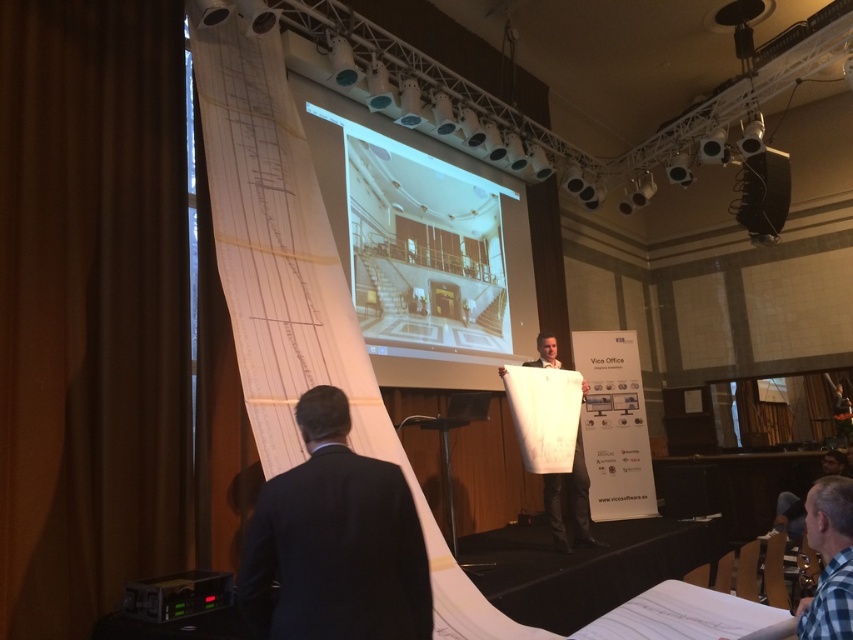
Between white matte projection screen at center and dark suit at lower left, which one appears on the left side from the viewer's perspective?

dark suit at lower left is more to the left.

Measure the distance between white matte projection screen at center and dark suit at lower left.

A distance of 3.50 meters exists between white matte projection screen at center and dark suit at lower left.

Find the location of a particular element. white matte projection screen at center is located at coordinates (424, 246).

Between brown fabric curtain at left and dark suit at lower left, which one appears on the right side from the viewer's perspective?

Positioned to the right is dark suit at lower left.

Between brown fabric curtain at left and dark suit at lower left, which one is positioned higher?

brown fabric curtain at left

Is point (54, 323) farther from camera compared to point (381, 554)?

Yes, it is behind point (381, 554).

Image resolution: width=853 pixels, height=640 pixels. In order to click on brown fabric curtain at left in this screenshot , I will do `click(90, 307)`.

Who is lower down, brown fabric curtain at left or white matte projection screen at center?

Positioned lower is brown fabric curtain at left.

Is point (48, 225) positioned before point (520, 292)?

Yes, point (48, 225) is closer to viewer.

The image size is (853, 640). Describe the element at coordinates (90, 307) in the screenshot. I see `brown fabric curtain at left` at that location.

At what (x,y) coordinates should I click in order to perform the action: click on brown fabric curtain at left. Please return your answer as a coordinate pair (x, y). This screenshot has height=640, width=853. Looking at the image, I should click on (90, 307).